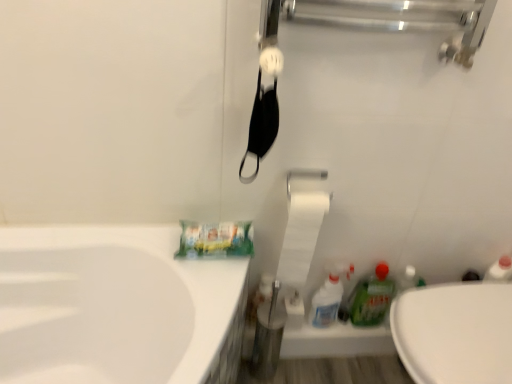
Question: Can white glossy toilet at lower right be found inside white glossy spray bottle at lower right, the second cleaning product viewed from the right?

Choices:
 (A) no
 (B) yes

Answer: (A)

Question: Is white glossy spray bottle at lower right, the second cleaning product viewed from the right, wider than white glossy toilet at lower right?

Choices:
 (A) no
 (B) yes

Answer: (A)

Question: Is white glossy spray bottle at lower right, the second cleaning product viewed from the right, next to white glossy toilet at lower right?

Choices:
 (A) no
 (B) yes

Answer: (A)

Question: From the image's perspective, would you say white glossy spray bottle at lower right, the second cleaning product viewed from the right, is shown under white glossy toilet at lower right?

Choices:
 (A) no
 (B) yes

Answer: (A)

Question: Is white glossy toilet at lower right at the back of white glossy spray bottle at lower right, the second cleaning product viewed from the right?

Choices:
 (A) yes
 (B) no

Answer: (B)

Question: Considering the positions of point (320, 299) and point (315, 173), is point (320, 299) closer or farther from the camera than point (315, 173)?

Choices:
 (A) closer
 (B) farther

Answer: (B)

Question: From a real-world perspective, is white glossy spray bottle at lower right, placed as the first cleaning product when sorted from left to right, above or below white glossy towel bar at upper center?

Choices:
 (A) below
 (B) above

Answer: (A)

Question: Is white glossy spray bottle at lower right, the second cleaning product viewed from the right, wider or thinner than white glossy towel bar at upper center?

Choices:
 (A) wide
 (B) thin

Answer: (B)

Question: From the image's perspective, relative to white glossy towel bar at upper center, is white glossy spray bottle at lower right, the second cleaning product viewed from the right, above or below?

Choices:
 (A) below
 (B) above

Answer: (A)

Question: From the image's perspective, relative to green glossy bottle at lower right, the 1th cleaning product in the right-to-left sequence, is white glossy toilet at lower right above or below?

Choices:
 (A) above
 (B) below

Answer: (B)

Question: Is white glossy toilet at lower right inside the boundaries of green glossy bottle at lower right, placed as the 2th cleaning product when sorted from left to right, or outside?

Choices:
 (A) outside
 (B) inside

Answer: (A)

Question: From a real-world perspective, is white glossy toilet at lower right above or below green glossy bottle at lower right, the 1th cleaning product in the right-to-left sequence?

Choices:
 (A) above
 (B) below

Answer: (B)

Question: Does point (423, 377) appear closer or farther from the camera than point (362, 311)?

Choices:
 (A) closer
 (B) farther

Answer: (A)

Question: Based on their sizes in the image, would you say green glossy bottle at lower right, placed as the 2th cleaning product when sorted from left to right, is bigger or smaller than white glossy spray bottle at lower right, placed as the first cleaning product when sorted from left to right?

Choices:
 (A) big
 (B) small

Answer: (B)

Question: Considering the positions of green glossy bottle at lower right, the 1th cleaning product in the right-to-left sequence, and white glossy spray bottle at lower right, the second cleaning product viewed from the right, in the image, is green glossy bottle at lower right, the 1th cleaning product in the right-to-left sequence, taller or shorter than white glossy spray bottle at lower right, the second cleaning product viewed from the right,?

Choices:
 (A) tall
 (B) short

Answer: (B)